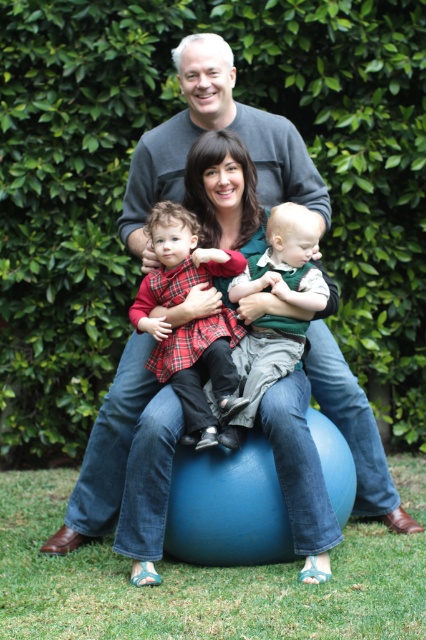
Can you confirm if green leafy hedge at upper center is smaller than green cotton shirt at center?

No.

Can you confirm if green leafy hedge at upper center is bigger than green cotton shirt at center?

Indeed, green leafy hedge at upper center has a larger size compared to green cotton shirt at center.

Is point (37, 328) farther from camera compared to point (301, 282)?

Yes, point (37, 328) is behind point (301, 282).

Image resolution: width=426 pixels, height=640 pixels. I want to click on green leafy hedge at upper center, so click(126, 176).

Who is lower down, green leafy hedge at upper center or plaid fabric dress at center?

Positioned lower is plaid fabric dress at center.

Can you confirm if green leafy hedge at upper center is taller than plaid fabric dress at center?

Yes.

Does point (86, 99) lie behind point (180, 292)?

Yes.

Image resolution: width=426 pixels, height=640 pixels. What are the coordinates of `green leafy hedge at upper center` in the screenshot? It's located at (126, 176).

Does plaid fabric dress at center have a lesser height compared to green cotton shirt at center?

No.

Does plaid fabric dress at center appear under green cotton shirt at center?

Actually, plaid fabric dress at center is above green cotton shirt at center.

Which is in front, point (187, 330) or point (253, 385)?

Point (253, 385) is more forward.

What are the coordinates of `plaid fabric dress at center` in the screenshot? It's located at (189, 321).